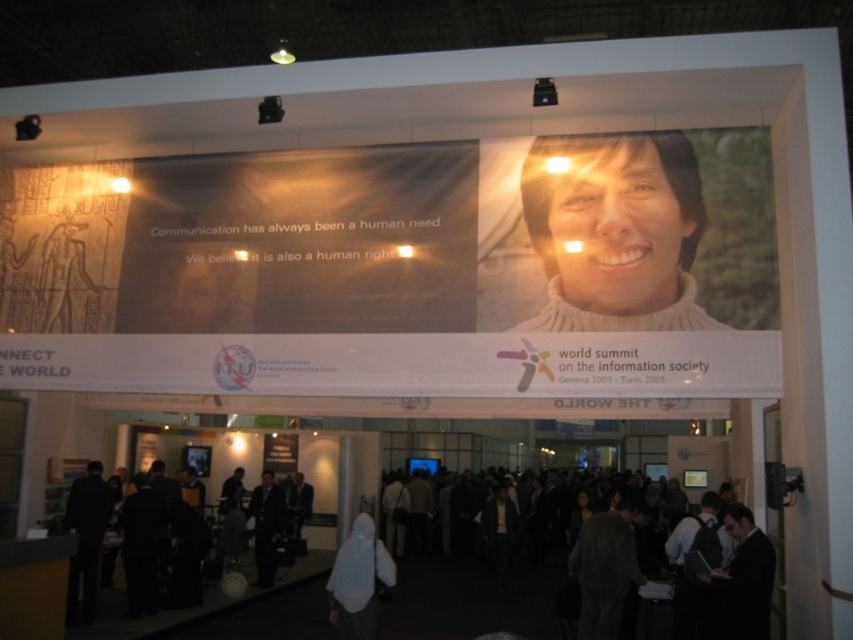
Question: Estimate the real-world distances between objects in this image. Which object is farther from the dark gray suit at lower left?

Choices:
 (A) dark gray suit at center
 (B) white fabric at lower center
 (C) matte white banner at upper center
 (D) sweater at upper right

Answer: (D)

Question: Can you confirm if dark suit at center is positioned to the right of dark gray sweater at center?

Choices:
 (A) no
 (B) yes

Answer: (A)

Question: Is the position of matte white banner at upper center less distant than that of dark gray suit at center?

Choices:
 (A) yes
 (B) no

Answer: (A)

Question: Which point is farther to the camera?

Choices:
 (A) (415, 524)
 (B) (363, 545)
 (C) (633, 552)
 (D) (628, 157)

Answer: (A)

Question: Which of these objects is positioned farthest from the sweater at upper right?

Choices:
 (A) dark gray suit at lower left
 (B) matte white banner at upper center
 (C) white fabric at lower center

Answer: (A)

Question: Does dark gray suit at center lie in front of dark gray sweater at center?

Choices:
 (A) yes
 (B) no

Answer: (A)